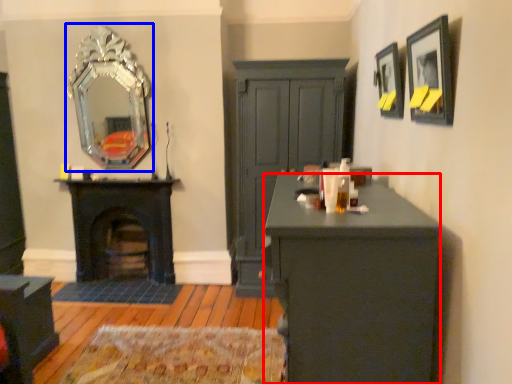
Question: Which object is closer to the camera taking this photo, desk (highlighted by a red box) or mirror (highlighted by a blue box)?

Choices:
 (A) desk
 (B) mirror

Answer: (A)